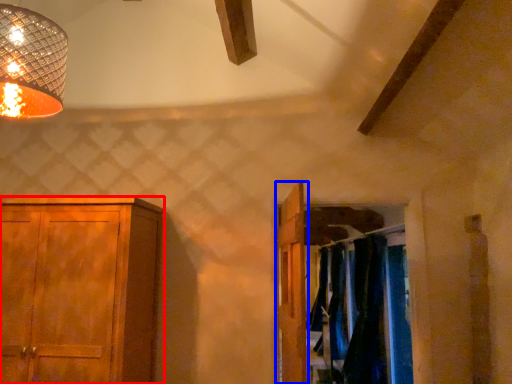
Question: Which object appears farthest to the camera in this image, cupboard (highlighted by a red box) or door (highlighted by a blue box)?

Choices:
 (A) cupboard
 (B) door

Answer: (A)